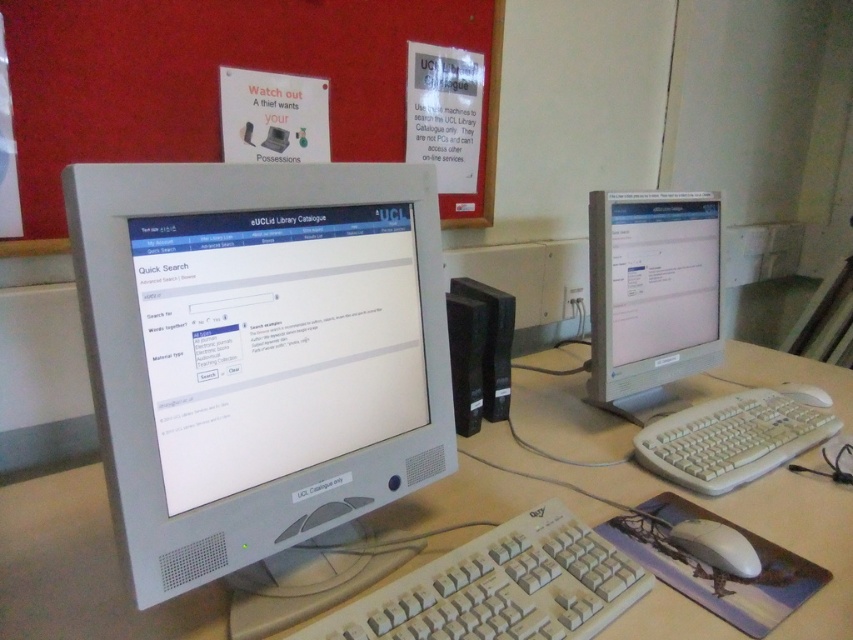
Is white plastic monitor at center below white plastic keyboard at lower right?

Actually, white plastic monitor at center is above white plastic keyboard at lower right.

Is white plastic monitor at center above white plastic keyboard at lower right?

Indeed, white plastic monitor at center is positioned over white plastic keyboard at lower right.

Is point (334, 310) behind point (759, 461)?

No, it is in front of (759, 461).

Where is `white plastic monitor at center`? white plastic monitor at center is located at coordinates (257, 353).

Between white plastic computer desk at center and matte silver monitor at right, which one is positioned higher?

matte silver monitor at right is higher up.

Does white plastic computer desk at center appear under matte silver monitor at right?

Yes.

What are the coordinates of `white plastic computer desk at center` in the screenshot? It's located at (80, 570).

You are a GUI agent. You are given a task and a screenshot of the screen. Output one action in this format:
    pyautogui.click(x=<x>, y=<y>)
    Task: Click on the white plastic computer desk at center
    This screenshot has height=640, width=853.
    Given the screenshot: What is the action you would take?
    pyautogui.click(x=80, y=570)

Can you confirm if white plastic monitor at center is positioned to the right of matte silver monitor at right?

In fact, white plastic monitor at center is to the left of matte silver monitor at right.

Is white plastic monitor at center below matte silver monitor at right?

Correct, white plastic monitor at center is located below matte silver monitor at right.

Is point (440, 337) less distant than point (679, 305)?

Yes, point (440, 337) is in front of point (679, 305).

Where is `white plastic monitor at center`? The height and width of the screenshot is (640, 853). white plastic monitor at center is located at coordinates (257, 353).